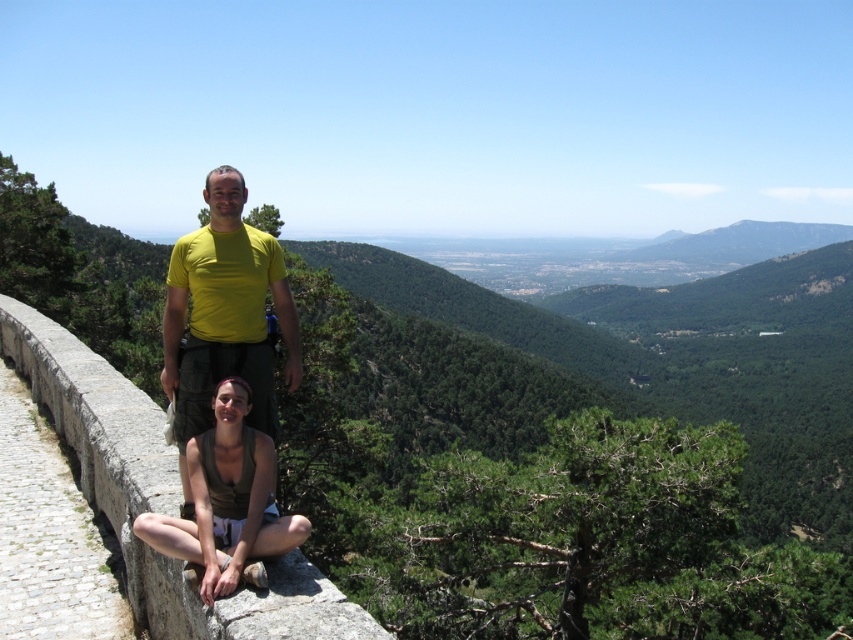
Does gray stone ledge at center appear over green fabric tank top at lower center?

Correct, gray stone ledge at center is located above green fabric tank top at lower center.

Is gray stone ledge at center thinner than green fabric tank top at lower center?

In fact, gray stone ledge at center might be wider than green fabric tank top at lower center.

In order to click on gray stone ledge at center in this screenshot , I will do `click(157, 497)`.

Which of these two, yellow matte t-shirt at center or green fabric tank top at lower center, stands taller?

yellow matte t-shirt at center is taller.

Locate an element on the screen. yellow matte t-shirt at center is located at coordinates [224, 316].

Can you confirm if gray stone ledge at center is bigger than yellow matte t-shirt at center?

Incorrect, gray stone ledge at center is not larger than yellow matte t-shirt at center.

Measure the distance from gray stone ledge at center to yellow matte t-shirt at center.

gray stone ledge at center and yellow matte t-shirt at center are 2.97 meters apart.

Is point (109, 374) positioned in front of point (165, 381)?

That is False.

Locate an element on the screen. Image resolution: width=853 pixels, height=640 pixels. gray stone ledge at center is located at coordinates (157, 497).